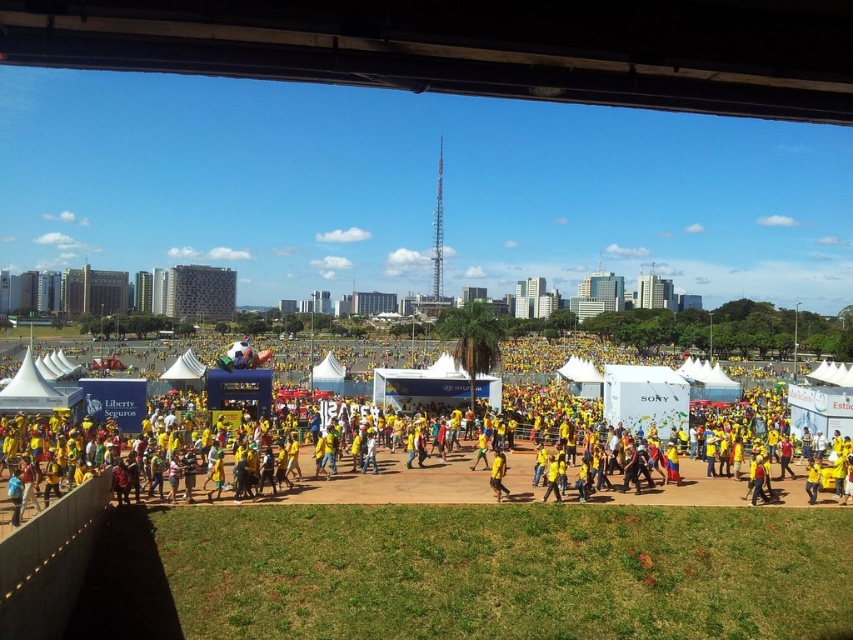
You are standing at the grassy area in the foreground of the scene. You see two points marked as point 1 at coordinates point (703,497) and point 2 at coordinates point (502,460). If you want to walk towards the point that is closer to you, which point should you head towards?

Point 1 at coordinates point (703,497) is closer to you because it is in front of point 2 at coordinates point (502,460).

You are a photographer trying to capture a photo of the yellow fabric person at center and the yellow matte shirt at center. Which one would appear larger in your photo?

The yellow fabric person at center would appear larger in the photo since it is much taller than the yellow matte shirt at center.

You are organizing a photo shoot for an event and need to place two participants wearing yellow clothing in the foreground. The participants are dressed in a yellow fabric person at center and a yellow matte shirt at center. To ensure they fit comfortably side by side without overlapping, which participant should you position closer to the edge to accommodate their size?

The yellow fabric person at center is wider than the yellow matte shirt at center, so you should position the yellow fabric person at center closer to the edge to accommodate their larger width.